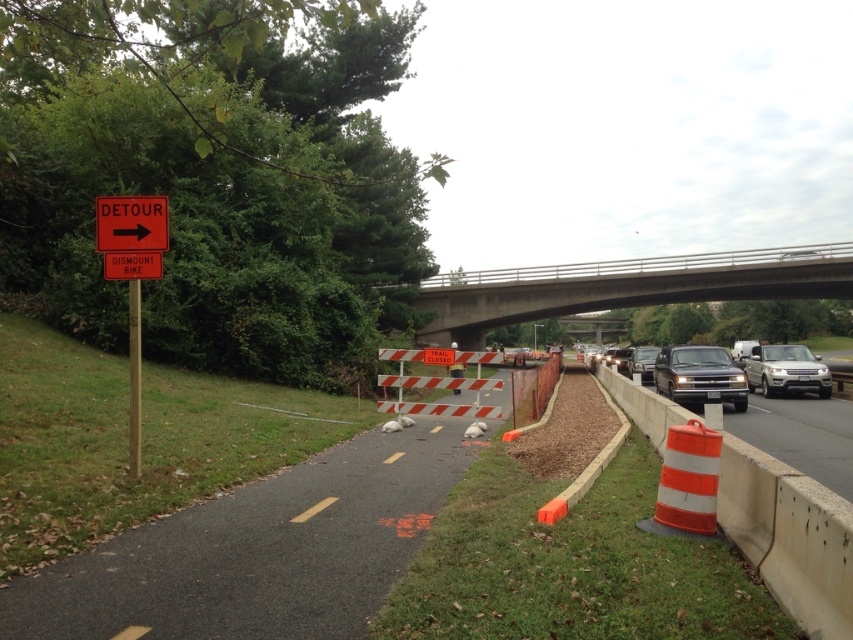
Question: Which object appears farthest from the camera in this image?

Choices:
 (A) satin black truck at right
 (B) metallic silver sedan at right

Answer: (B)

Question: Estimate the real-world distances between objects in this image. Which object is closer to the orange striped barrier at right?

Choices:
 (A) satin silver suv at center
 (B) red plastic detour sign at upper left

Answer: (A)

Question: Is orange reflective traffic cone at right above red plastic detour sign at upper left?

Choices:
 (A) no
 (B) yes

Answer: (A)

Question: Which of the following is the farthest from the observer?

Choices:
 (A) satin silver suv at center
 (B) red plastic detour sign at upper left

Answer: (A)

Question: Is satin black truck at right closer to camera compared to orange reflective plastic sign at upper left?

Choices:
 (A) yes
 (B) no

Answer: (B)

Question: Is satin black truck at right bigger than metallic silver sedan at right?

Choices:
 (A) no
 (B) yes

Answer: (A)